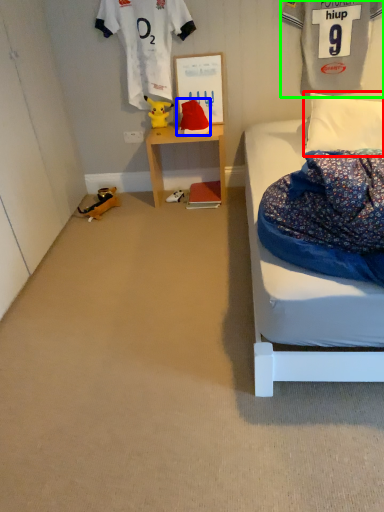
Question: Estimate the real-world distances between objects in this image. Which object is farther from pillow (highlighted by a red box), toy (highlighted by a blue box) or clothing (highlighted by a green box)?

Choices:
 (A) toy
 (B) clothing

Answer: (A)